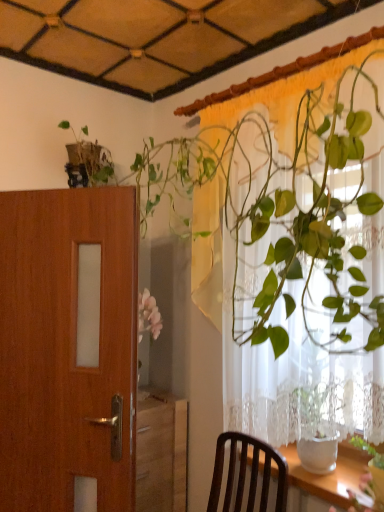
Find the location of a particular element. This screenshot has width=384, height=512. green leafy plant at upper right is located at coordinates (298, 248).

Find the location of `wooden door at left`. wooden door at left is located at coordinates (68, 348).

Does point (135, 367) come behind point (278, 220)?

Yes, it is.

In terms of width, does wooden door at left look wider or thinner when compared to green glossy plant at upper right?

wooden door at left is thinner than green glossy plant at upper right.

Can you confirm if wooden door at left is shorter than green glossy plant at upper right?

Yes.

Can you confirm if wooden door at left is positioned to the right of green glossy plant at upper right?

No.

Considering the sizes of green leafy plant at upper right and green glossy plant at upper right in the image, is green leafy plant at upper right taller or shorter than green glossy plant at upper right?

Clearly, green leafy plant at upper right is taller compared to green glossy plant at upper right.

Is there a large distance between green leafy plant at upper right and green glossy plant at upper right?

No, green leafy plant at upper right is not far away from green glossy plant at upper right.

Is green glossy plant at upper right surrounded by green leafy plant at upper right?

Actually, green glossy plant at upper right is outside green leafy plant at upper right.

Who is smaller, green leafy plant at upper right or wooden door at left?

With smaller size is wooden door at left.

Can you confirm if green leafy plant at upper right is shorter than wooden door at left?

No.

Which object is positioned more to the right, green leafy plant at upper right or wooden door at left?

green leafy plant at upper right.

Is green glossy plant at upper right not inside green leafy plant at upper right?

green glossy plant at upper right lies outside green leafy plant at upper right's area.

Does point (262, 248) appear closer or farther from the camera than point (368, 285)?

Clearly, point (262, 248) is closer to the camera than point (368, 285).

Is green glossy plant at upper right in contact with green leafy plant at upper right?

Yes, green glossy plant at upper right is in contact with green leafy plant at upper right.

Is green glossy plant at upper right closer to camera compared to green leafy plant at upper right?

Yes, it is.

You are a GUI agent. You are given a task and a screenshot of the screen. Output one action in this format:
    pyautogui.click(x=<x>, y=<y>)
    Task: Click on the door behind the green leafy plant at upper right
    The image size is (384, 512).
    Given the screenshot: What is the action you would take?
    pyautogui.click(x=68, y=348)

From a real-world perspective, is wooden door at left below green leafy plant at upper right?

Yes.

Is wooden door at left next to green leafy plant at upper right?

There is a gap between wooden door at left and green leafy plant at upper right.

Between green glossy plant at upper right and wooden door at left, which one appears on the left side from the viewer's perspective?

wooden door at left.

Which is farther, (x=157, y=173) or (x=77, y=192)?

The point (x=157, y=173) is farther from the camera.

Which of these two, green glossy plant at upper right or wooden door at left, is thinner?

With smaller width is wooden door at left.

Consider the image. Does green glossy plant at upper right touch wooden door at left?

There is a gap between green glossy plant at upper right and wooden door at left.

At what (x,y) coordinates should I click in order to perform the action: click on houseplant positioned vertically above the wooden door at left (from a real-world perspective). Please return your answer as a coordinate pair (x, y). This screenshot has width=384, height=512. Looking at the image, I should click on (282, 200).

The width and height of the screenshot is (384, 512). Find the location of `houseplant on the left of the green leafy plant at upper right`. houseplant on the left of the green leafy plant at upper right is located at coordinates (282, 200).

Considering their positions, is wooden door at left positioned closer to green glossy plant at upper right than green leafy plant at upper right?

green leafy plant at upper right is positioned closer to the anchor green glossy plant at upper right.

Considering their positions, is green leafy plant at upper right positioned further to green glossy plant at upper right than wooden door at left?

Based on the image, wooden door at left appears to be further to green glossy plant at upper right.

From the picture: Which object lies further to the anchor point wooden door at left, green leafy plant at upper right or green glossy plant at upper right?

The object further to wooden door at left is green leafy plant at upper right.

From the image, which object appears to be nearer to wooden door at left, green glossy plant at upper right or green leafy plant at upper right?

green glossy plant at upper right lies closer to wooden door at left than the other object.

Based on their spatial positions, is green glossy plant at upper right or wooden door at left further from green leafy plant at upper right?

Among the two, wooden door at left is located further to green leafy plant at upper right.

Considering their positions, is wooden door at left positioned further to green leafy plant at upper right than green glossy plant at upper right?

Among the two, wooden door at left is located further to green leafy plant at upper right.

Identify the location of houseplant between wooden door at left and green leafy plant at upper right. (282, 200).